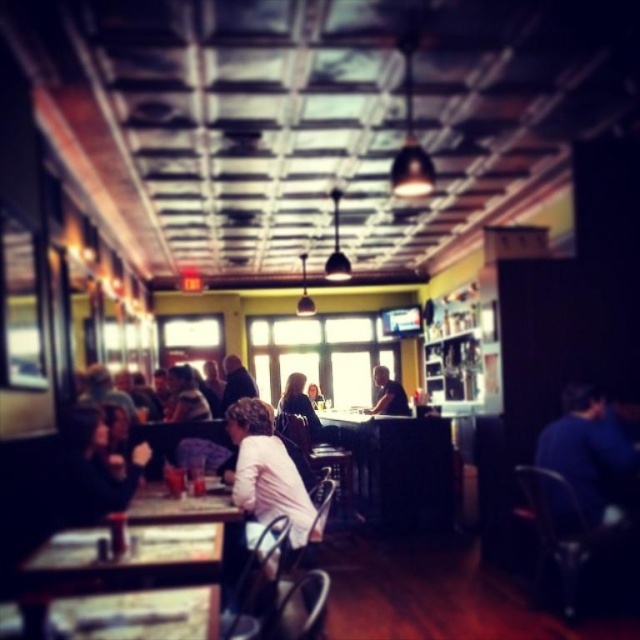
Question: Is the position of matte black shirt at center less distant than that of dark blue shirt at center?

Choices:
 (A) no
 (B) yes

Answer: (A)

Question: Which point is farther from the camera taking this photo?

Choices:
 (A) (170, 500)
 (B) (92, 412)
 (C) (244, 388)
 (D) (257, 516)

Answer: (C)

Question: Can you confirm if blue matte shirt at right is positioned to the right of dark blue sweater at center?

Choices:
 (A) yes
 (B) no

Answer: (A)

Question: Which point appears farthest from the camera in this image?

Choices:
 (A) (401, 400)
 (B) (74, 442)
 (C) (264, 470)
 (D) (547, 442)

Answer: (A)

Question: Which object appears closest to the camera in this image?

Choices:
 (A) dark blue sweater at center
 (B) dark blue shirt at center
 (C) matte black shirt at center
 (D) white matte shirt at center

Answer: (D)

Question: Can you confirm if blue matte shirt at right is thinner than dark blue sweater at center?

Choices:
 (A) yes
 (B) no

Answer: (B)